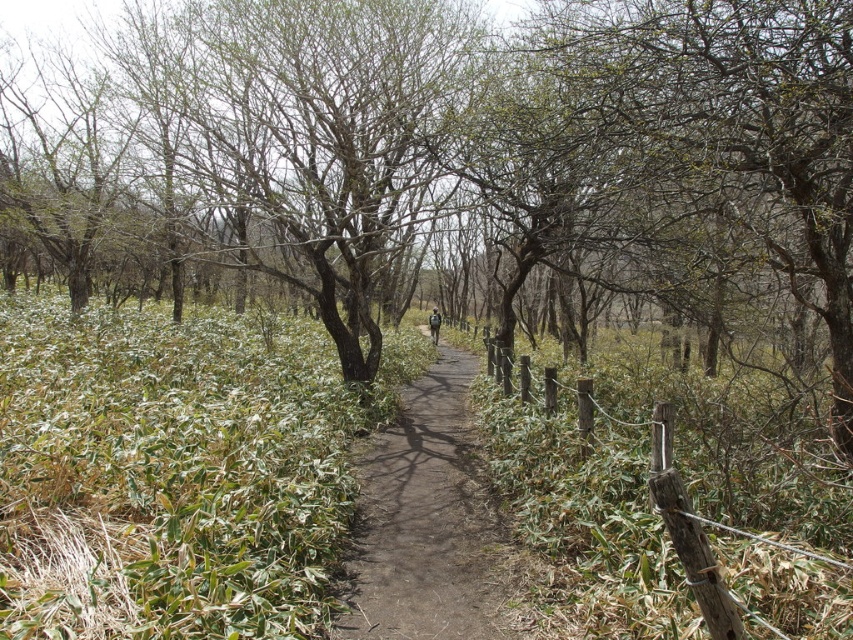
Is green leafy shrub at center wider than dirt path at center?

Yes, green leafy shrub at center is wider than dirt path at center.

Is point (84, 230) closer to viewer compared to point (468, 593)?

No, (84, 230) is behind (468, 593).

Identify the location of green leafy shrub at center. Image resolution: width=853 pixels, height=640 pixels. (450, 160).